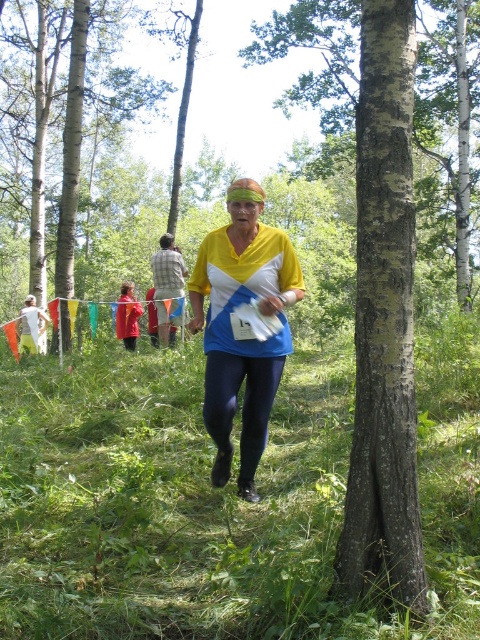
Looking at the race path, you see the green bark tree at center and the brown bark tree at upper left. Which tree is positioned to the right side of the other?

The green bark tree at center is positioned to the right of the brown bark tree at upper left.

You are a participant in the race and want to know which of the two points, point (208, 264) or point (20, 342), is closer to you. Based on the scene description, which point is nearer?

Point (208, 264) is closer to the viewer than point (20, 342).